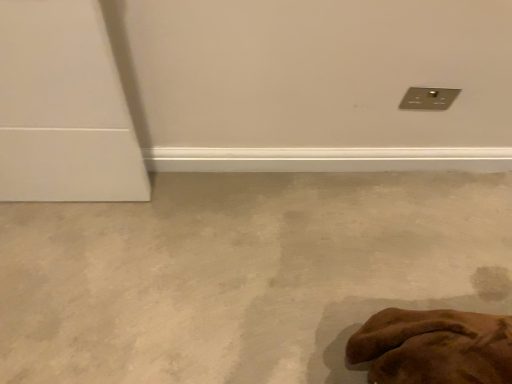
Locate an element on the screen. This screenshot has height=384, width=512. gold metallic power plug/socket at upper right is located at coordinates (428, 98).

The height and width of the screenshot is (384, 512). What do you see at coordinates (428, 98) in the screenshot? I see `gold metallic power plug/socket at upper right` at bounding box center [428, 98].

What is the approximate height of gold metallic power plug/socket at upper right?

gold metallic power plug/socket at upper right is 10.29 centimeters in height.

Where is `gold metallic power plug/socket at upper right`? gold metallic power plug/socket at upper right is located at coordinates (428, 98).